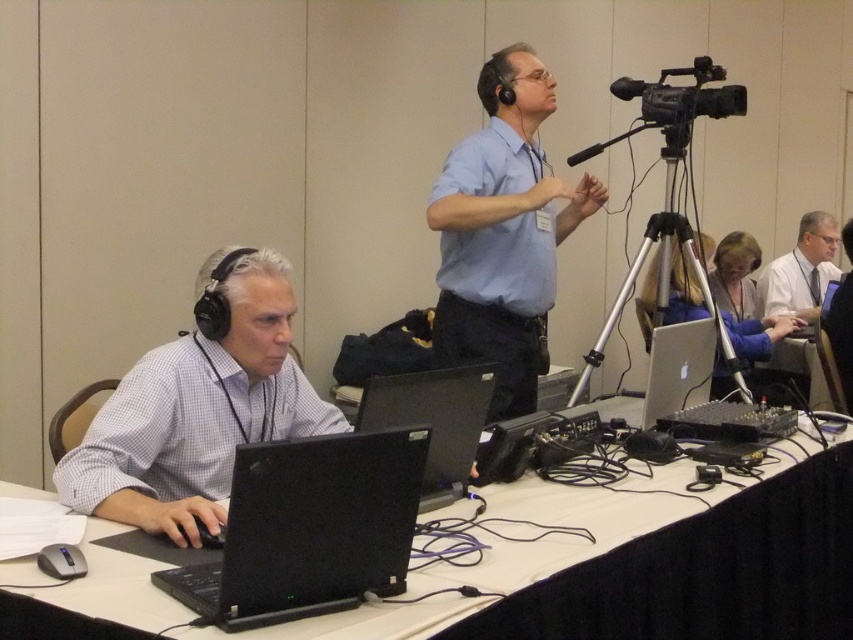
You are organizing a meeting and need to place a new laptop on the table. Based on the image, where is the black plastic table at lower left in relation to the black matte microphone at upper center?

The black plastic table at lower left is located below the black matte microphone at upper center.

You are a technician in a conference room. You need to adjust the angle of the black plastic video camera at upper right so it can capture the black matte laptop at center. Is the camera currently positioned above or below the laptop?

The black matte laptop at center is below the black plastic video camera at upper right, so the camera is positioned above the laptop.